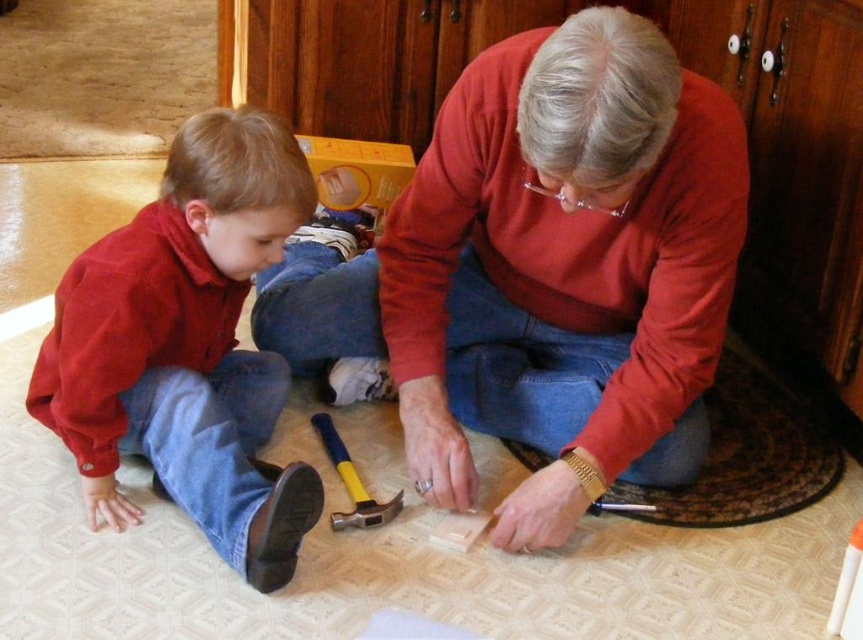
Does matte red shirt at lower left have a larger size compared to yellow rubber hammer at center?

Indeed, matte red shirt at lower left has a larger size compared to yellow rubber hammer at center.

Which is more to the left, matte red shirt at lower left or yellow rubber hammer at center?

Positioned to the left is matte red shirt at lower left.

This screenshot has height=640, width=863. I want to click on matte red shirt at lower left, so click(x=187, y=346).

Is matte wood block at center closer to camera compared to yellow rubber hammer at center?

Yes, matte wood block at center is in front of yellow rubber hammer at center.

Can you confirm if matte wood block at center is positioned to the right of yellow rubber hammer at center?

Indeed, matte wood block at center is positioned on the right side of yellow rubber hammer at center.

At what (x,y) coordinates should I click in order to perform the action: click on matte wood block at center. Please return your answer as a coordinate pair (x, y). The height and width of the screenshot is (640, 863). Looking at the image, I should click on (545, 273).

Which is behind, point (391, 333) or point (213, 323)?

The point (391, 333) is behind.

From the picture: Is matte wood block at center bigger than matte red shirt at lower left?

Yes, matte wood block at center is bigger than matte red shirt at lower left.

Who is more distant from viewer, (716, 150) or (137, 449)?

The point (137, 449) is more distant.

Find the location of a particular element. matte wood block at center is located at coordinates (x=545, y=273).